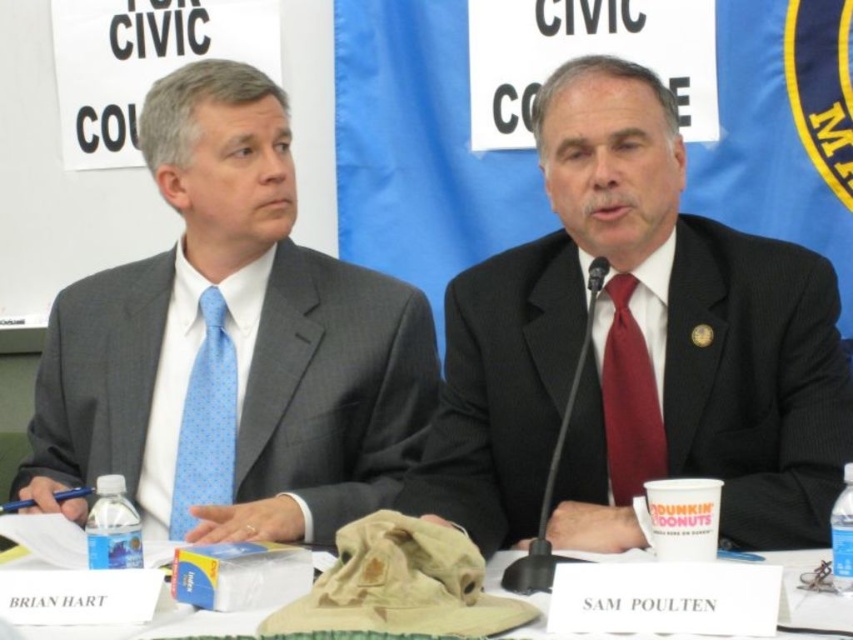
Between matte gray suit at center and red satin tie at center, which one appears on the right side from the viewer's perspective?

Positioned to the right is red satin tie at center.

Does matte gray suit at center lie behind red satin tie at center?

No, matte gray suit at center is in front of red satin tie at center.

Who is more distant from viewer, (x=196, y=483) or (x=645, y=372)?

The point (x=196, y=483) is more distant.

I want to click on matte gray suit at center, so [x=231, y=346].

Between point (247, 172) and point (822, 596), which one is positioned behind?

The point (247, 172) is more distant.

Is matte gray suit at center closer to camera compared to white paper at center?

That is False.

The height and width of the screenshot is (640, 853). Describe the element at coordinates (231, 346) in the screenshot. I see `matte gray suit at center` at that location.

At what (x,y) coordinates should I click in order to perform the action: click on matte gray suit at center. Please return your answer as a coordinate pair (x, y). Looking at the image, I should click on (231, 346).

Can you confirm if white paper at center is shorter than blue dotted tie at left?

Indeed, white paper at center has a lesser height compared to blue dotted tie at left.

Is point (62, 630) farther from viewer compared to point (223, 317)?

No, (62, 630) is closer to viewer.

Who is more distant from viewer, (798, 608) or (213, 445)?

The point (213, 445) is more distant.

I want to click on white paper at center, so click(x=154, y=627).